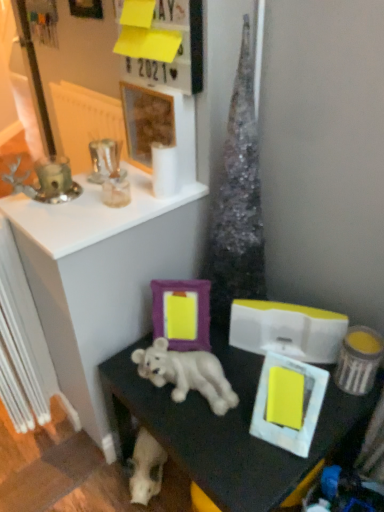
Find the location of a particular element. vacant region to the left of white matte picture frame at lower right, marked as the 4th picture frame in a left-to-right arrangement is located at coordinates (221, 448).